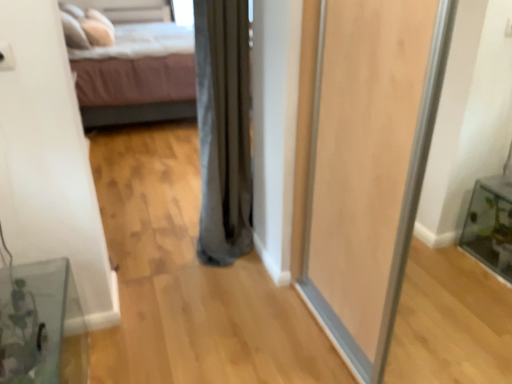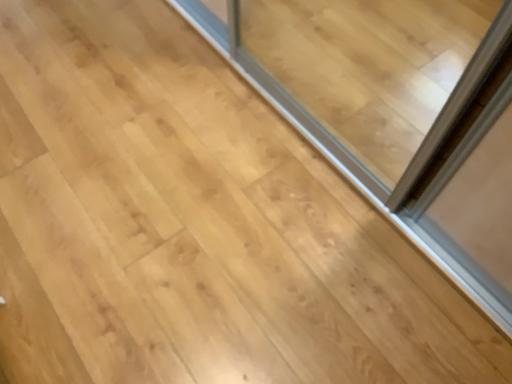
Question: How did the camera likely rotate when shooting the video?

Choices:
 (A) rotated upward
 (B) rotated downward

Answer: (B)